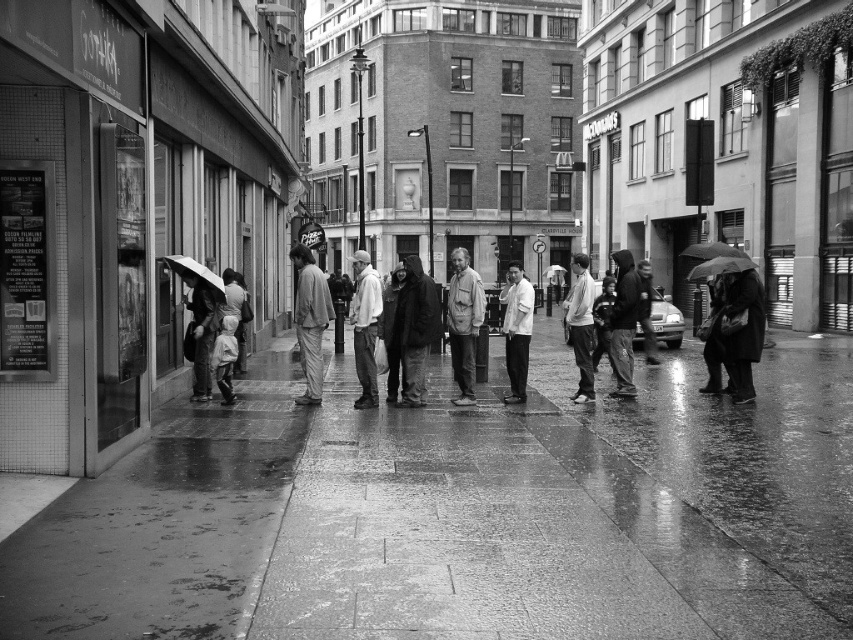
Question: Which point appears farthest from the camera in this image?

Choices:
 (A) (735, 260)
 (B) (199, 307)
 (C) (531, 307)
 (D) (730, 246)

Answer: (D)

Question: Does matte black jacket at left have a smaller size compared to white matte umbrella at left?

Choices:
 (A) yes
 (B) no

Answer: (B)

Question: Is the position of light gray hoodie at center less distant than that of transparent plastic umbrella at center?

Choices:
 (A) no
 (B) yes

Answer: (B)

Question: Can you confirm if dark gray hoodie at center is thinner than light gray fabric jacket at center?

Choices:
 (A) yes
 (B) no

Answer: (B)

Question: Which object is farther from the camera taking this photo?

Choices:
 (A) white matte shirt at center
 (B) white matte umbrella at left

Answer: (A)

Question: Which of the following is the closest to the observer?

Choices:
 (A) light gray fabric jacket at center
 (B) dark fabric coat at center
 (C) matte gray jacket at center

Answer: (B)